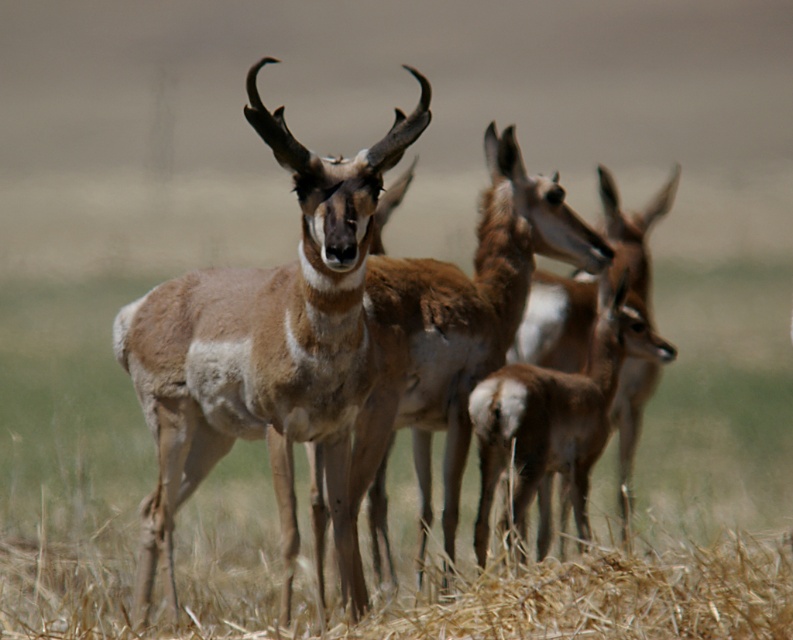
Question: Among these objects, which one is nearest to the camera?

Choices:
 (A) brown furry deer at center
 (B) brown fur antelope at center

Answer: (B)

Question: Can you confirm if brown fur antelope at center is positioned above brown furry deer at center?

Choices:
 (A) no
 (B) yes

Answer: (B)

Question: Which object appears farthest from the camera in this image?

Choices:
 (A) brown fur antelope at center
 (B) brown furry deer at center

Answer: (B)

Question: Is brown fur antelope at center bigger than brown furry deer at center?

Choices:
 (A) yes
 (B) no

Answer: (A)

Question: Can you confirm if brown fur antelope at center is bigger than brown furry deer at center?

Choices:
 (A) no
 (B) yes

Answer: (B)